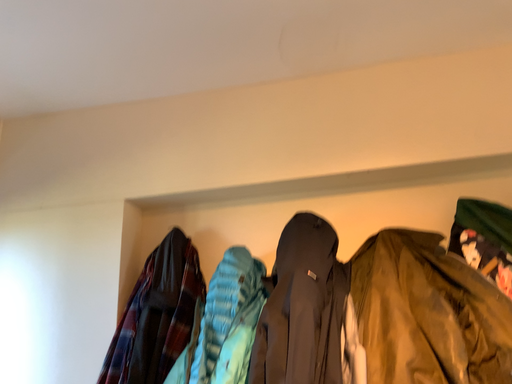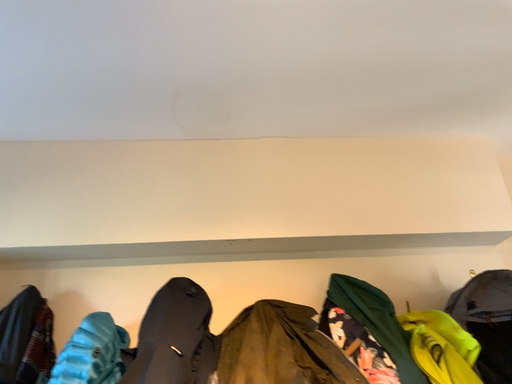
Question: How did the camera likely rotate when shooting the video?

Choices:
 (A) rotated upward
 (B) rotated downward

Answer: (A)